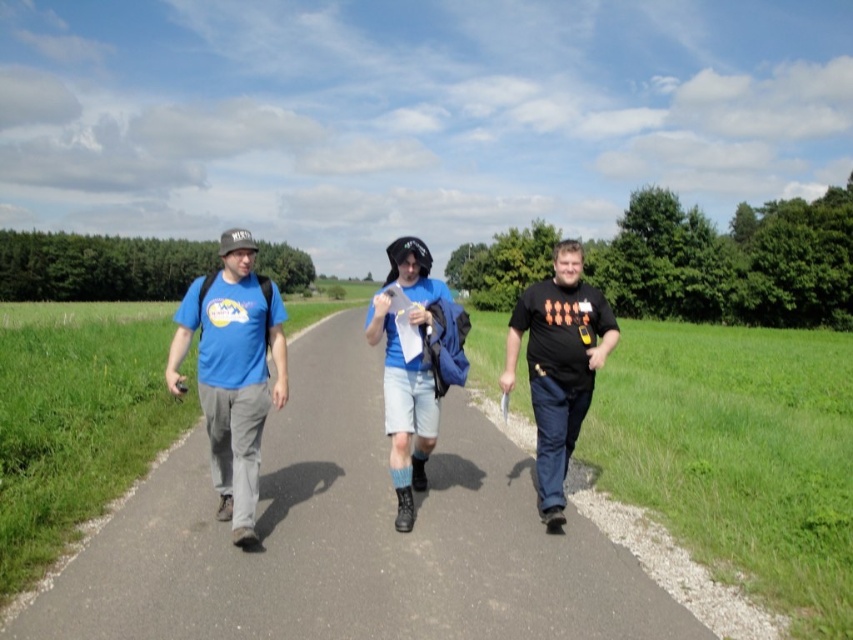
Measure the distance from smooth asphalt road at center to matte blue t-shirt at left.

A distance of 1.78 meters exists between smooth asphalt road at center and matte blue t-shirt at left.

Who is positioned more to the right, smooth asphalt road at center or matte blue t-shirt at left?

smooth asphalt road at center

Which is in front, point (361, 461) or point (225, 269)?

Positioned in front is point (225, 269).

Where is `smooth asphalt road at center`? This screenshot has width=853, height=640. smooth asphalt road at center is located at coordinates (349, 538).

Which of these two, matte blue t-shirt at left or black matte t-shirt at center, stands taller?

With more height is black matte t-shirt at center.

Consider the image. Is matte blue t-shirt at left wider than black matte t-shirt at center?

Yes, matte blue t-shirt at left is wider than black matte t-shirt at center.

What are the coordinates of `matte blue t-shirt at left` in the screenshot? It's located at (231, 371).

Is matte blue t-shirt at left further to the viewer compared to blue cotton t-shirt at center?

Yes, it is behind blue cotton t-shirt at center.

Identify the location of matte blue t-shirt at left. (231, 371).

Is point (172, 355) closer to viewer compared to point (515, 337)?

Yes, point (172, 355) is in front of point (515, 337).

I want to click on matte blue t-shirt at left, so click(x=231, y=371).